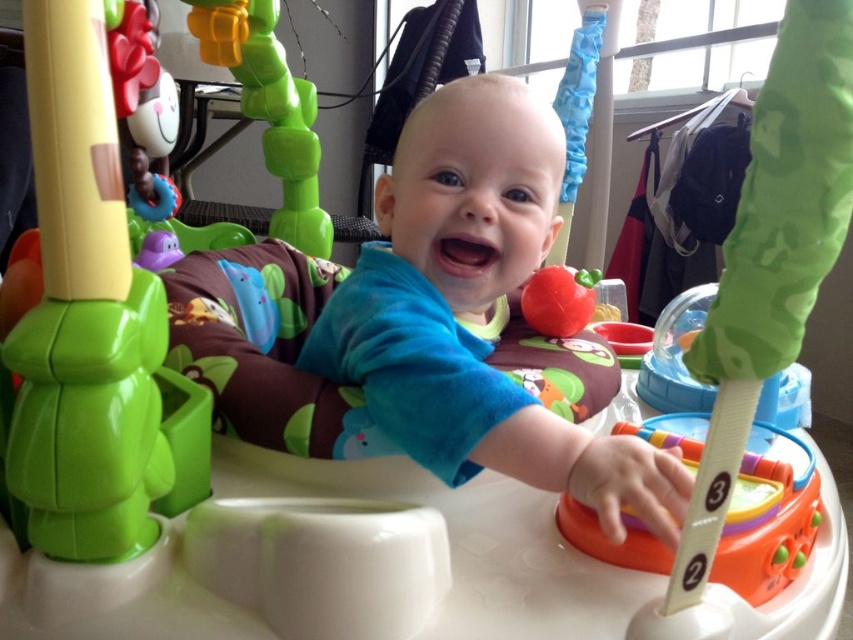
Does blue soft baby at center have a smaller size compared to rubberized red apple at center?

No.

Does blue soft baby at center have a greater width compared to rubberized red apple at center?

Indeed, blue soft baby at center has a greater width compared to rubberized red apple at center.

I want to click on blue soft baby at center, so click(421, 317).

In the scene shown: Between green plastic toy at upper center and rubberized red apple at center, which one is positioned higher?

green plastic toy at upper center is higher up.

Where is `green plastic toy at upper center`? This screenshot has width=853, height=640. green plastic toy at upper center is located at coordinates (270, 109).

Can you confirm if blue soft baby at center is thinner than green plastic toy at left?

No, blue soft baby at center is not thinner than green plastic toy at left.

Consider the image. Which is more to the right, blue soft baby at center or green plastic toy at left?

blue soft baby at center is more to the right.

Find the location of a particular element. blue soft baby at center is located at coordinates (421, 317).